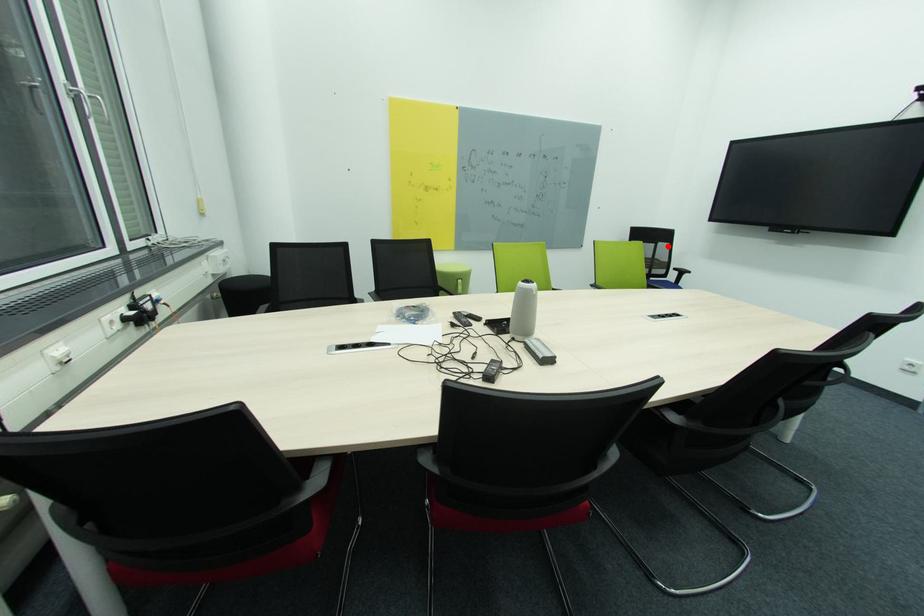
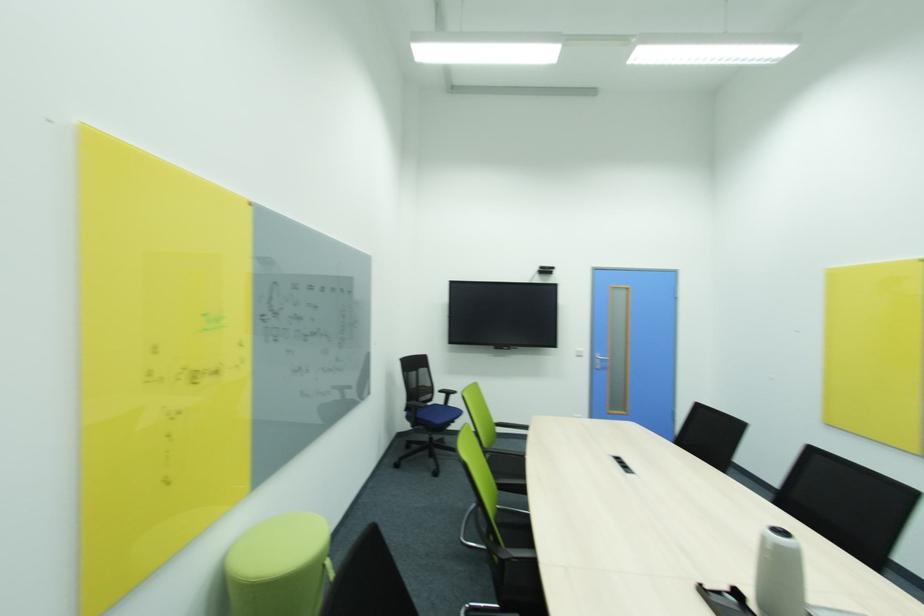
The point at the highlighted location is marked in the first image. Where is the corresponding point in the second image?

(428, 371)